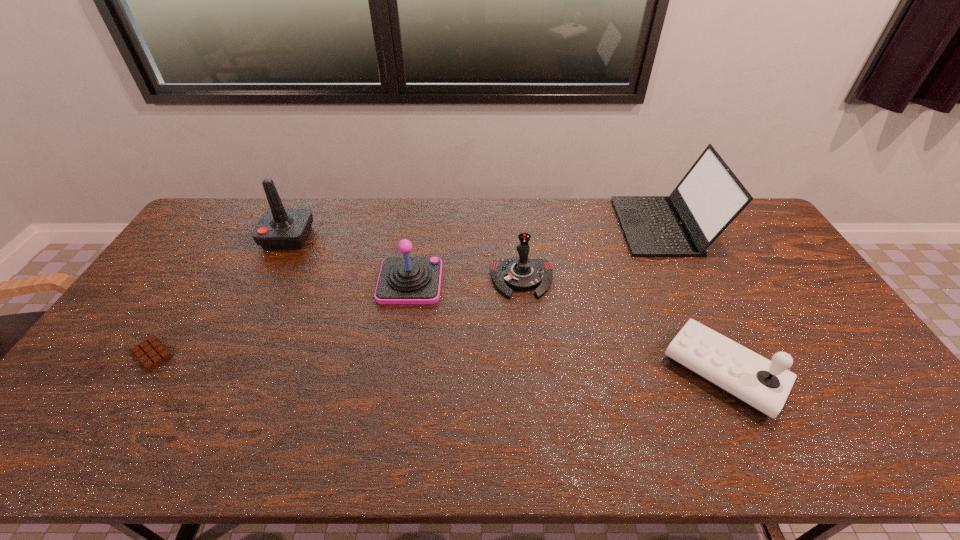
Where is `vacant space in between the rightmost joystick and the second joystick from right to left`? vacant space in between the rightmost joystick and the second joystick from right to left is located at coordinates (623, 326).

The height and width of the screenshot is (540, 960). I want to click on free space between the shortest object and the fourth object from left to right, so click(x=337, y=316).

At what (x,y) coordinates should I click in order to perform the action: click on free space between the laptop and the leftmost joystick. Please return your answer as a coordinate pair (x, y). Looking at the image, I should click on (475, 232).

Where is `object that is the fifth nearest to the laptop`? This screenshot has height=540, width=960. object that is the fifth nearest to the laptop is located at coordinates (151, 352).

Find the location of a particular element. object that can be found as the closest to the leftmost joystick is located at coordinates (402, 280).

Locate which joystick ranks second in proximity to the tallest joystick. Please provide its 2D coordinates. Your answer should be formatted as a tuple, i.e. [(x, y)], where the tuple contains the x and y coordinates of a point satisfying the conditions above.

[(521, 273)]

I want to click on the second closest joystick relative to the fourth object from right to left, so click(279, 228).

The image size is (960, 540). I want to click on free location that satisfies the following two spatial constraints: 1. on the surface of the laptop; 2. on the handle side of the second joystick from right to left, so click(x=689, y=279).

Locate an element on the screen. The image size is (960, 540). vacant area in the image that satisfies the following two spatial constraints: 1. on the handle side of the fourth object from left to right; 2. forward from the base of the third object from left to right is located at coordinates (522, 281).

Image resolution: width=960 pixels, height=540 pixels. I want to click on vacant area in the image that satisfies the following two spatial constraints: 1. on the back side of the second object from left to right; 2. on the right side of the shortest object, so tap(228, 238).